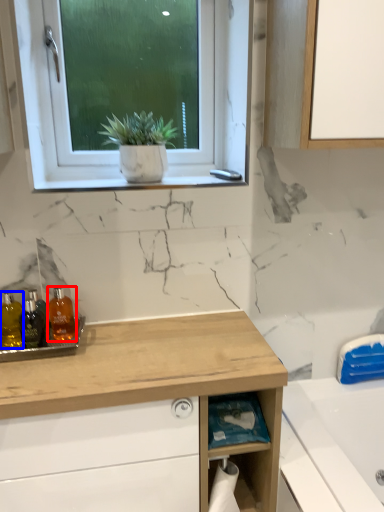
Question: Among these objects, which one is nearest to the camera, toiletry (highlighted by a red box) or toiletry (highlighted by a blue box)?

Choices:
 (A) toiletry
 (B) toiletry

Answer: (B)